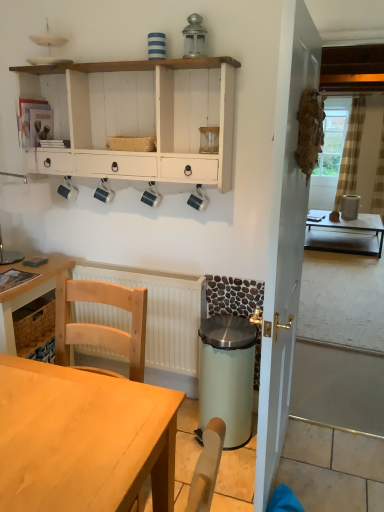
Question: Should I look upward or downward to see clear glass coffee cup at upper center, placed as the 5th coffee cup when sorted from left to right?

Choices:
 (A) down
 (B) up

Answer: (B)

Question: Is matte black coffee cup at center, which is the 3th coffee cup from left to right, thinner than clear glass window screen at upper right?

Choices:
 (A) yes
 (B) no

Answer: (A)

Question: Is matte black coffee cup at center, which is the 3th coffee cup from left to right, looking in the opposite direction of clear glass window screen at upper right?

Choices:
 (A) yes
 (B) no

Answer: (A)

Question: Could you tell me if matte black coffee cup at center, which is the 3th coffee cup from left to right, is facing clear glass window screen at upper right?

Choices:
 (A) yes
 (B) no

Answer: (B)

Question: From a real-world perspective, is matte black coffee cup at center, which is the 3th coffee cup from left to right, located beneath clear glass window screen at upper right?

Choices:
 (A) yes
 (B) no

Answer: (A)

Question: Is matte black coffee cup at center, which is the 3th coffee cup from left to right, located outside clear glass window screen at upper right?

Choices:
 (A) no
 (B) yes

Answer: (B)

Question: From the image's perspective, would you say matte black coffee cup at center, which is the third coffee cup from right to left, is shown under clear glass window screen at upper right?

Choices:
 (A) no
 (B) yes

Answer: (B)

Question: Considering the relative sizes of white wooden door at center and white plastic radiator at lower center in the image provided, is white wooden door at center bigger than white plastic radiator at lower center?

Choices:
 (A) no
 (B) yes

Answer: (B)

Question: Considering the relative sizes of white wooden door at center and white plastic radiator at lower center in the image provided, is white wooden door at center taller than white plastic radiator at lower center?

Choices:
 (A) yes
 (B) no

Answer: (A)

Question: Can you confirm if white wooden door at center is positioned to the right of white plastic radiator at lower center?

Choices:
 (A) yes
 (B) no

Answer: (A)

Question: Can you confirm if white wooden door at center is positioned to the left of white plastic radiator at lower center?

Choices:
 (A) yes
 (B) no

Answer: (B)

Question: Are white wooden door at center and white plastic radiator at lower center making contact?

Choices:
 (A) no
 (B) yes

Answer: (A)

Question: Is white wooden door at center facing towards white plastic radiator at lower center?

Choices:
 (A) yes
 (B) no

Answer: (B)

Question: Does metallic lantern at upper center have a lesser width compared to clear glass coffee cup at upper center, placed as the 5th coffee cup when sorted from left to right?

Choices:
 (A) no
 (B) yes

Answer: (B)